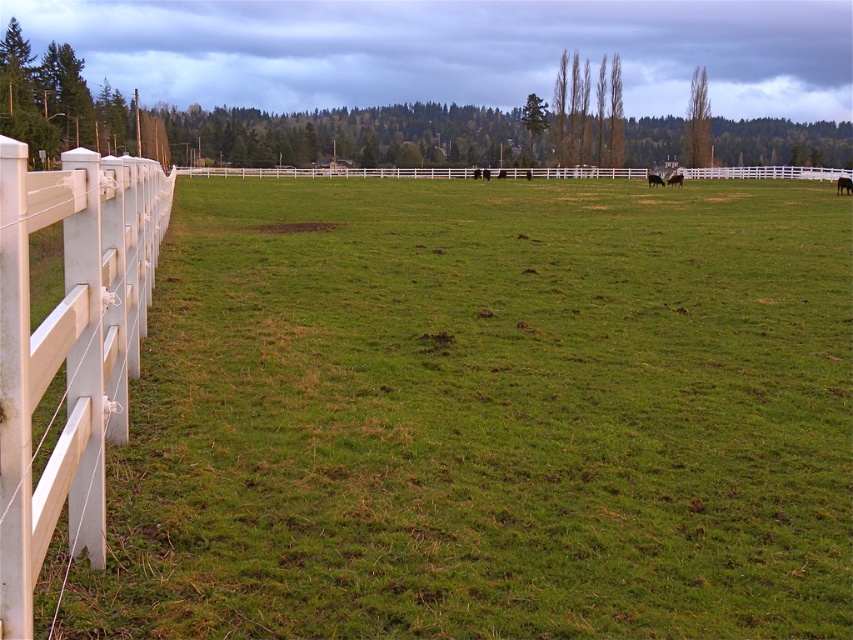
You are a farmer checking the field. You see the white plastic fence at center and the black glossy horse at center. Which object takes up more space in the image?

The white plastic fence at center is bigger than the black glossy horse at center, so it takes up more space in the image.

You are a farmer checking your property. You see the white plastic fence at center and the black glossy cow at right. Is the cow currently inside your fenced area?

The black glossy cow at right is behind the white plastic fence at center, so it is outside the fenced area.